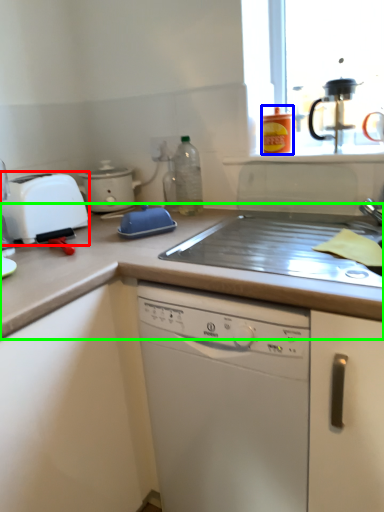
Question: Which object is the closest to the toaster (highlighted by a red box)? Choose among these: kitchen appliance (highlighted by a blue box) or countertop (highlighted by a green box).

Choices:
 (A) kitchen appliance
 (B) countertop

Answer: (B)